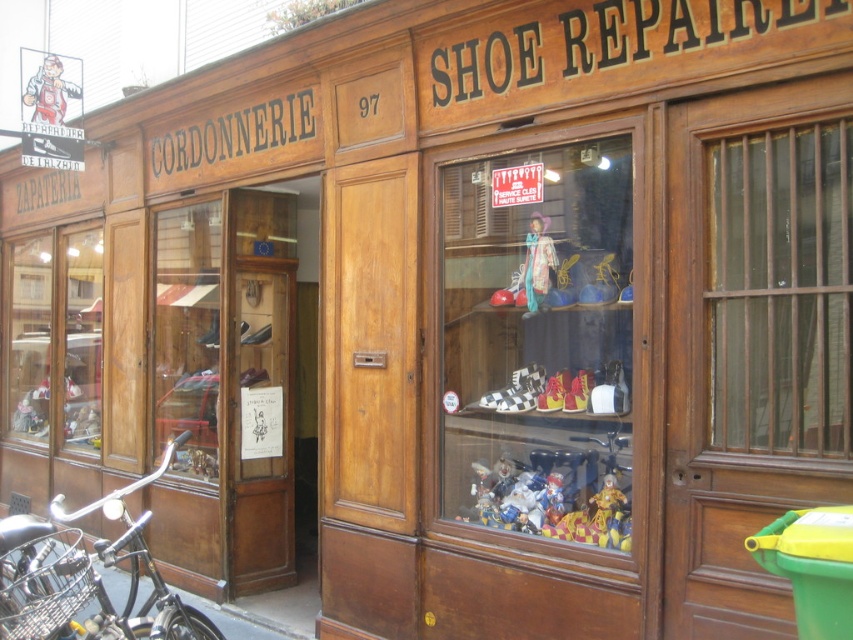
Question: Which of these objects is positioned farthest from the black matte bicycle at lower left?

Choices:
 (A) multicolored plastic clown at center
 (B) matte glass shop window at center

Answer: (B)

Question: Among these objects, which one is farthest from the camera?

Choices:
 (A) matte glass shop window at center
 (B) black matte bicycle at lower left
 (C) transparent glass window at right
 (D) multicolored plastic clown at center

Answer: (D)

Question: Which point is closer to the camera taking this photo?

Choices:
 (A) (117, 620)
 (B) (469, 362)

Answer: (A)

Question: Is the position of matte glass shop window at center more distant than that of transparent glass window at right?

Choices:
 (A) yes
 (B) no

Answer: (A)

Question: Is matte glass shop window at center bigger than multicolored plastic clown at center?

Choices:
 (A) yes
 (B) no

Answer: (A)

Question: Is transparent glass window at right below black matte bicycle at lower left?

Choices:
 (A) no
 (B) yes

Answer: (A)